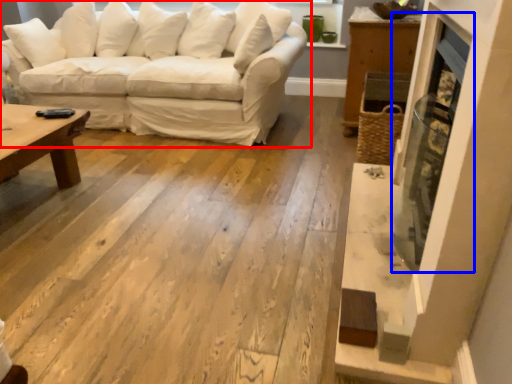
Question: Among these objects, which one is farthest to the camera, studio couch (highlighted by a red box) or fireplace (highlighted by a blue box)?

Choices:
 (A) studio couch
 (B) fireplace

Answer: (A)